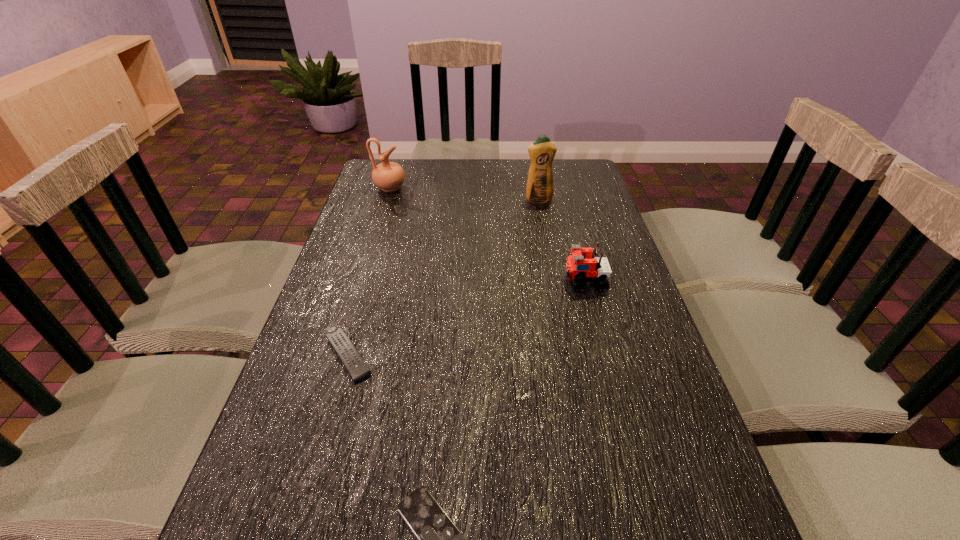
Identify the location of the closest object to the nearer remote control. The height and width of the screenshot is (540, 960). (355, 365).

At what (x,y) coordinates should I click in order to perform the action: click on vacant space that satisfies the following two spatial constraints: 1. on the back side of the second shortest object; 2. on the spout of the pottery. Please return your answer as a coordinate pair (x, y). The width and height of the screenshot is (960, 540). Looking at the image, I should click on click(396, 188).

Image resolution: width=960 pixels, height=540 pixels. Find the location of `vacant area that satisfies the following two spatial constraints: 1. on the spout of the second tallest object; 2. on the back side of the taller remote control`. vacant area that satisfies the following two spatial constraints: 1. on the spout of the second tallest object; 2. on the back side of the taller remote control is located at coordinates (339, 356).